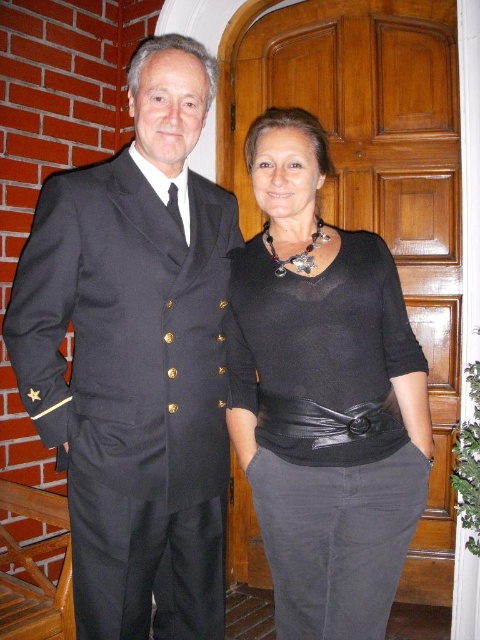
You are standing at the point marked by coordinates point (x=131, y=545). You want to walk to the man in the naval uniform. Which direction should you go?

The man in the naval uniform is to the left of the point (x=131, y=545). You should walk to the left.

You are a photographer setting up a shoot in a room with a wooden door and brick wall. You need to ensure that the black wool suit at left and the black matte sweater at center are visible in the frame. Based on their positions, which clothing item is higher up in the image?

The black wool suit at left is above the black matte sweater at center, so the black wool suit at left is higher up in the image.